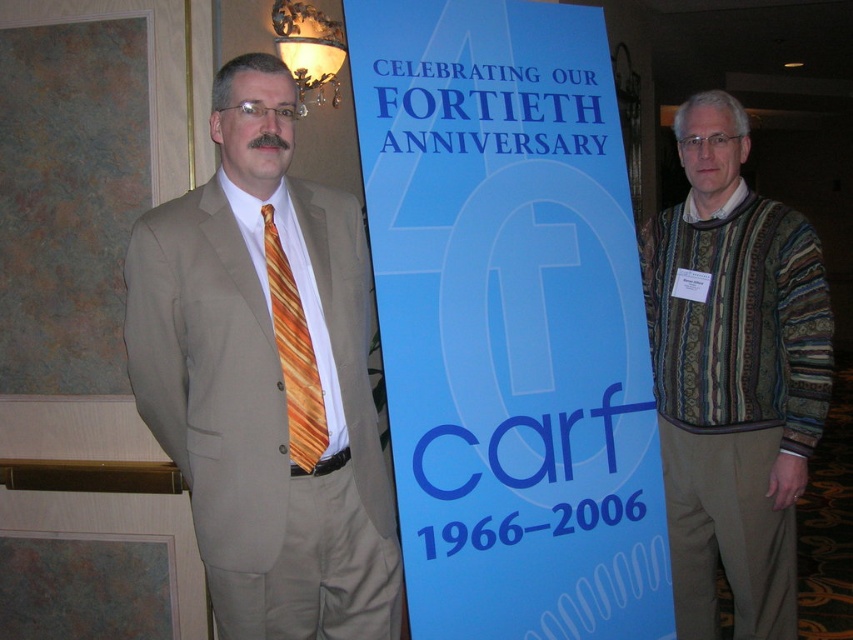
Does blue paper sign at center have a smaller size compared to striped sweater at right?

Actually, blue paper sign at center might be larger than striped sweater at right.

Who is taller, blue paper sign at center or striped sweater at right?

blue paper sign at center is taller.

What do you see at coordinates (509, 321) in the screenshot? I see `blue paper sign at center` at bounding box center [509, 321].

Where is `blue paper sign at center`? blue paper sign at center is located at coordinates (509, 321).

Is matte beige suit at center above striped sweater at right?

Yes, matte beige suit at center is above striped sweater at right.

In order to click on matte beige suit at center in this screenshot , I will do `click(265, 378)`.

Does blue paper sign at center have a larger size compared to orange striped tie at left?

Indeed, blue paper sign at center has a larger size compared to orange striped tie at left.

Who is lower down, blue paper sign at center or orange striped tie at left?

orange striped tie at left is below.

Is point (535, 256) behind point (270, 304)?

Yes, point (535, 256) is farther from viewer.

The width and height of the screenshot is (853, 640). In order to click on blue paper sign at center in this screenshot , I will do `click(509, 321)`.